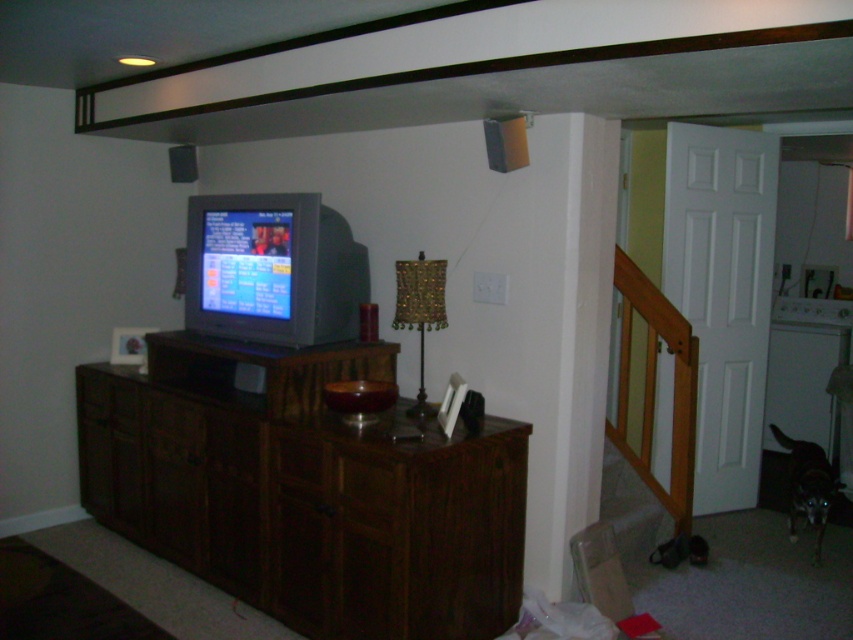
Based on the photo, can you confirm if matte gray tv at center is taller than brown wood drawer at center?

Indeed, matte gray tv at center has a greater height compared to brown wood drawer at center.

Identify the location of matte gray tv at center. This screenshot has width=853, height=640. (271, 269).

Is dark wood dresser at center shorter than matte gray tv at center?

Incorrect, dark wood dresser at center's height does not fall short of matte gray tv at center's.

Which is more to the left, dark wood dresser at center or matte gray tv at center?

dark wood dresser at center is more to the left.

The height and width of the screenshot is (640, 853). Identify the location of dark wood dresser at center. (305, 492).

The width and height of the screenshot is (853, 640). Identify the location of dark wood dresser at center. (305, 492).

Looking at this image, can you confirm if dark wood dresser at center is smaller than brown wood drawer at center?

No.

Which is more to the left, dark wood dresser at center or brown wood drawer at center?

From the viewer's perspective, dark wood dresser at center appears more on the left side.

Does point (473, 580) lie in front of point (299, 476)?

Yes, point (473, 580) is in front of point (299, 476).

Locate an element on the screen. The width and height of the screenshot is (853, 640). dark wood dresser at center is located at coordinates (305, 492).